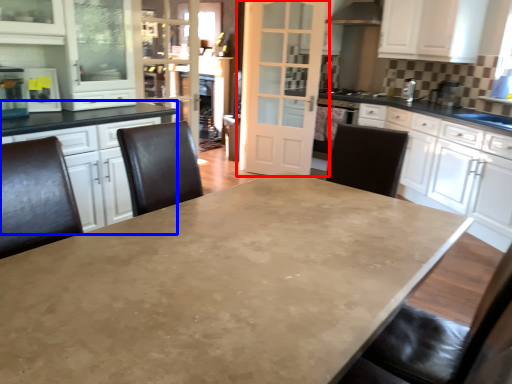
Question: Which of the following is the closest to the observer, door (highlighted by a red box) or counter top (highlighted by a blue box)?

Choices:
 (A) door
 (B) counter top

Answer: (B)